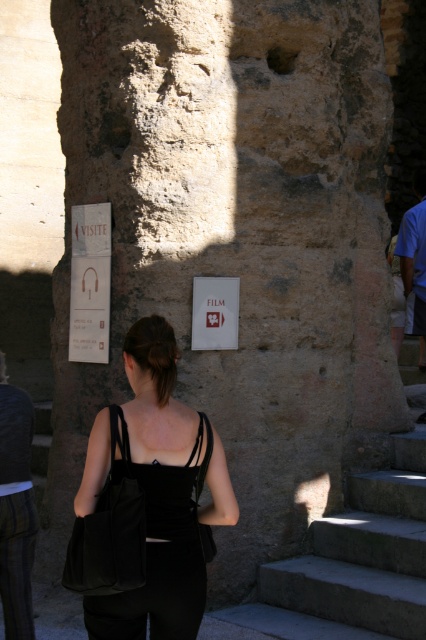
Question: Can you confirm if matte white sign at left is bigger than white paper sign at center?

Choices:
 (A) no
 (B) yes

Answer: (B)

Question: Which of the following is the closest to the observer?

Choices:
 (A) white paper sign at center
 (B) black fabric bag at center
 (C) matte white sign at left
 (D) gray concrete stairs at lower right

Answer: (B)

Question: Which point is closer to the camera taking this photo?

Choices:
 (A) [417, 476]
 (B) [94, 257]
 (C) [80, 496]

Answer: (C)

Question: Which of the following is the farthest from the observer?

Choices:
 (A) gray concrete stairs at lower right
 (B) black fabric bag at center

Answer: (A)

Question: Can you confirm if black fabric bag at center is thinner than white paper sign at center?

Choices:
 (A) no
 (B) yes

Answer: (A)

Question: Does black fabric bag at center appear under gray concrete stairs at lower right?

Choices:
 (A) yes
 (B) no

Answer: (B)